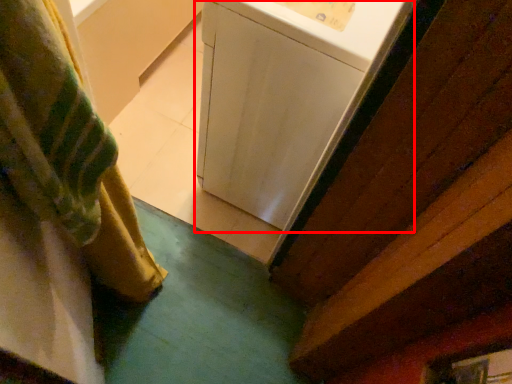
Question: From the image's perspective, considering the relative positions of washing machine (annotated by the red box) and curtain in the image provided, where is washing machine (annotated by the red box) located with respect to the staircase?

Choices:
 (A) below
 (B) above

Answer: (B)